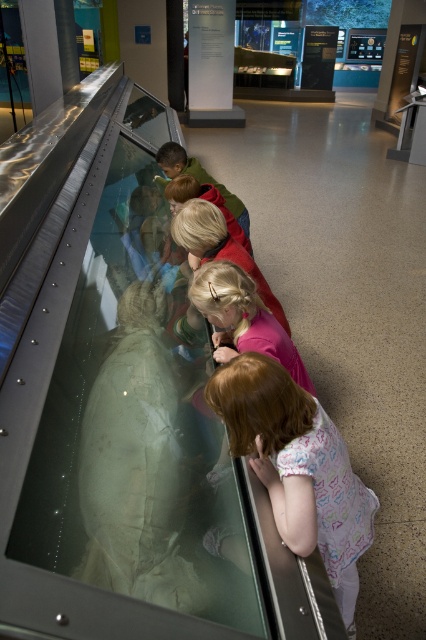
Question: Does light brown fabric dress at lower center appear on the right side of pink fabric at center?

Choices:
 (A) yes
 (B) no

Answer: (A)

Question: Which of the following is the closest to the observer?

Choices:
 (A) (184, 240)
 (B) (238, 276)

Answer: (B)

Question: Can you confirm if light brown fabric dress at lower center is positioned to the left of blonde hair at center?

Choices:
 (A) no
 (B) yes

Answer: (A)

Question: From the image, what is the correct spatial relationship of light brown fabric dress at lower center in relation to pink fabric at center?

Choices:
 (A) below
 (B) above

Answer: (A)

Question: Considering the real-world distances, which object is farthest from the blonde hair at center?

Choices:
 (A) light brown fabric dress at lower center
 (B) pink fabric at center

Answer: (A)

Question: Which object appears farthest from the camera in this image?

Choices:
 (A) pink fabric at center
 (B) light brown fabric dress at lower center
 (C) blonde hair at center

Answer: (C)